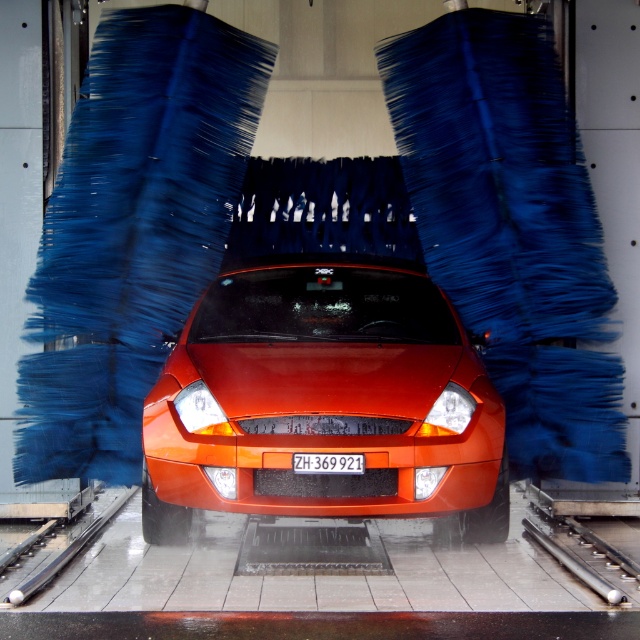
You are a car wash technician and need to ensure the orange matte car at center can fit through a narrow tunnel entrance. The entrance is only as wide as the white plastic license plate at center. Based on the scene, will the car fit through the entrance?

The orange matte car at center is wider than the white plastic license plate at center, so it will not fit through the entrance which is only as wide as the license plate.

You are a car wash attendant and need to access the license plate of the orange matte car at center for inspection. Can you directly reach the white plastic license plate at center while the car is in its current position inside the automated car wash system?

The white plastic license plate at center is behind the orange matte car at center, so you cannot directly reach it while the car is in its current position inside the automated car wash system.